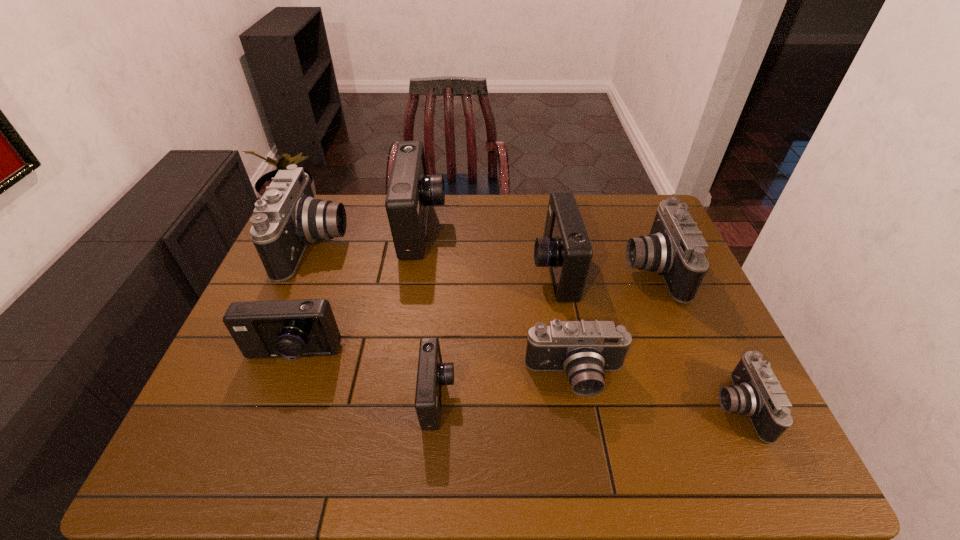
I want to click on free space located 0.270m on the front-facing side of the smallest black camera, so [598, 407].

At what (x,y) coordinates should I click in order to perform the action: click on free space located on the front-facing side of the smallest black camera. Please return your answer as a coordinate pair (x, y). The width and height of the screenshot is (960, 540). Looking at the image, I should click on (620, 407).

Identify the location of object that is at the far left corner. (287, 218).

Where is `object at the near right corner`? The width and height of the screenshot is (960, 540). object at the near right corner is located at coordinates (757, 393).

This screenshot has height=540, width=960. Find the location of `free space at the far edge of the desktop`. free space at the far edge of the desktop is located at coordinates (591, 236).

The width and height of the screenshot is (960, 540). In order to click on vacant region at the near edge of the desktop in this screenshot , I will do `click(678, 447)`.

The width and height of the screenshot is (960, 540). I want to click on free spot at the left edge of the desktop, so click(x=237, y=370).

The height and width of the screenshot is (540, 960). In the image, there is a desktop. Find the location of `vacant region at the right edge`. vacant region at the right edge is located at coordinates (662, 286).

Find the location of `free space at the near right corner of the desktop`. free space at the near right corner of the desktop is located at coordinates (712, 465).

Find the location of a particular element. Image resolution: width=960 pixels, height=540 pixels. free area in between the rightmost blue camera and the biggest blue camera is located at coordinates (488, 249).